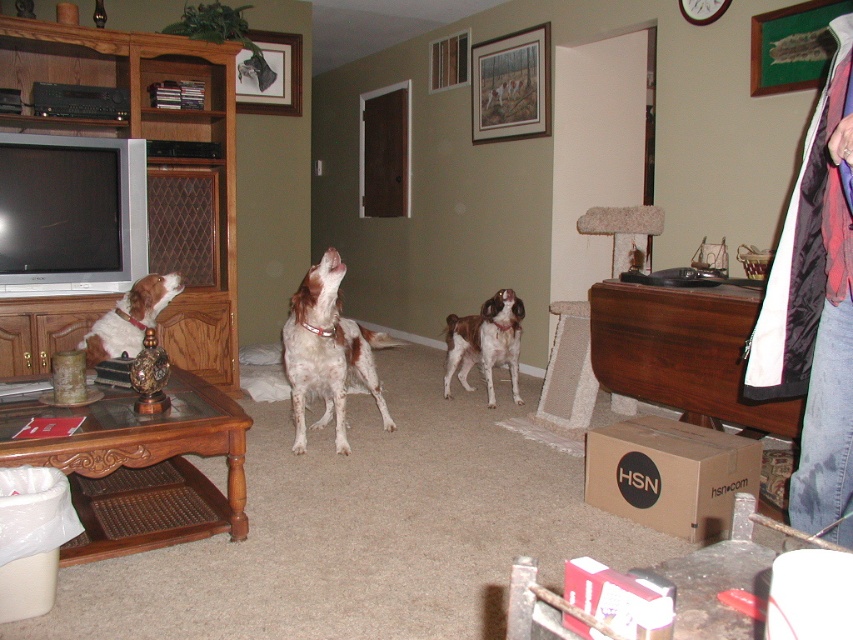
Is brown speckled fur at center bigger than brown speckled fur at left?

Yes.

Does point (332, 282) come behind point (94, 326)?

No, it is not.

What are the coordinates of `brown speckled fur at center` in the screenshot? It's located at (328, 353).

Does denim jacket at lower right have a lesser width compared to brown speckled fur dog at center?

Yes, denim jacket at lower right is thinner than brown speckled fur dog at center.

Does denim jacket at lower right come in front of brown speckled fur dog at center?

Yes, denim jacket at lower right is in front of brown speckled fur dog at center.

The image size is (853, 640). Describe the element at coordinates (827, 426) in the screenshot. I see `denim jacket at lower right` at that location.

Locate an element on the screen. This screenshot has width=853, height=640. denim jacket at lower right is located at coordinates click(x=827, y=426).

Is wooden entertainment center at left to the left of denim jacket at lower right from the viewer's perspective?

Indeed, wooden entertainment center at left is positioned on the left side of denim jacket at lower right.

Is wooden entertainment center at left closer to camera compared to denim jacket at lower right?

No, it is behind denim jacket at lower right.

The width and height of the screenshot is (853, 640). Describe the element at coordinates (155, 164) in the screenshot. I see `wooden entertainment center at left` at that location.

Image resolution: width=853 pixels, height=640 pixels. What are the coordinates of `wooden entertainment center at left` in the screenshot? It's located at (155, 164).